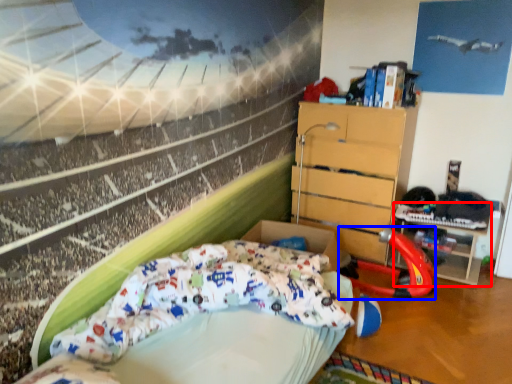
Question: Among these objects, which one is farthest to the camera, table (highlighted by a red box) or sport equipment (highlighted by a blue box)?

Choices:
 (A) table
 (B) sport equipment

Answer: (A)